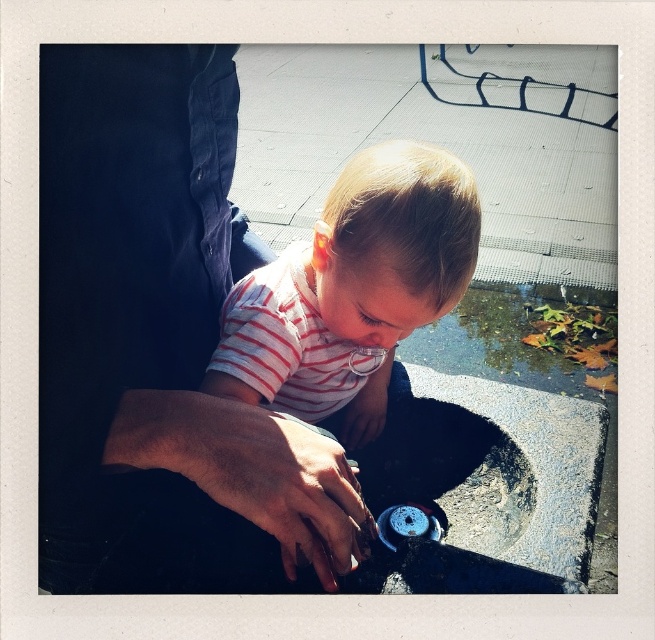
Question: Which object is farther from the camera taking this photo?

Choices:
 (A) dark skin/hair at center
 (B) white striped shirt at center

Answer: (B)

Question: Which object appears farthest from the camera in this image?

Choices:
 (A) white striped shirt at center
 (B) dark blue jeans at left

Answer: (A)

Question: Can you confirm if white striped shirt at center is positioned below dark skin/hair at center?

Choices:
 (A) yes
 (B) no

Answer: (B)

Question: Can you confirm if white striped shirt at center is positioned to the left of dark skin/hair at center?

Choices:
 (A) yes
 (B) no

Answer: (A)

Question: Can you confirm if dark blue jeans at left is smaller than white striped shirt at center?

Choices:
 (A) yes
 (B) no

Answer: (B)

Question: Which point is farther to the camera?

Choices:
 (A) dark skin/hair at center
 (B) white striped shirt at center
 (C) dark blue jeans at left

Answer: (B)